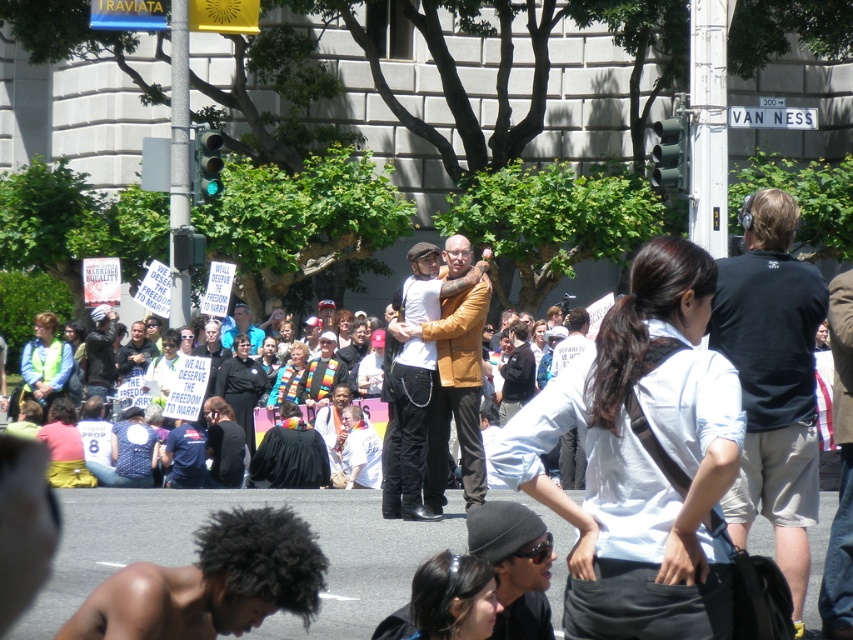
Is point (776, 440) positioned behind point (410, 250)?

No, (776, 440) is closer to viewer.

Does black cotton t-shirt at right appear on the left side of brown leather jacket at center?

Incorrect, black cotton t-shirt at right is not on the left side of brown leather jacket at center.

What do you see at coordinates (772, 381) in the screenshot? I see `black cotton t-shirt at right` at bounding box center [772, 381].

Locate an element on the screen. The height and width of the screenshot is (640, 853). black cotton t-shirt at right is located at coordinates (772, 381).

Is black cotton t-shirt at right smaller than matte black jacket at center?

Yes, black cotton t-shirt at right is smaller than matte black jacket at center.

Does black cotton t-shirt at right have a larger size compared to matte black jacket at center?

Incorrect, black cotton t-shirt at right is not larger than matte black jacket at center.

Identify the location of black cotton t-shirt at right. This screenshot has width=853, height=640. (772, 381).

Image resolution: width=853 pixels, height=640 pixels. What are the coordinates of `black cotton t-shirt at right` in the screenshot? It's located at (772, 381).

Does brown leather jacket at center appear over matte black jacket at center?

Indeed, brown leather jacket at center is positioned over matte black jacket at center.

Which is behind, point (457, 268) or point (102, 324)?

Positioned behind is point (102, 324).

Measure the distance between point (x=412, y=392) and camera.

A distance of 19.24 meters exists between point (x=412, y=392) and camera.

Identify the location of brown leather jacket at center. This screenshot has height=640, width=853. (434, 394).